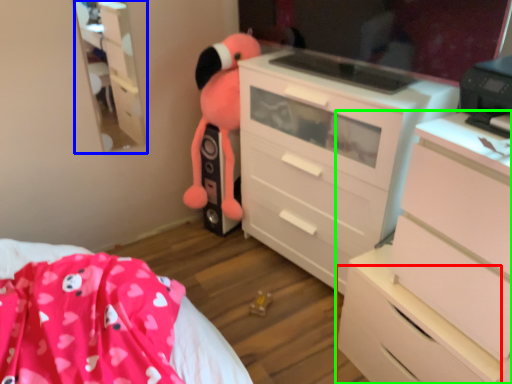
Question: Based on their relative distances, which object is farther from drawer (highlighted by a red box)? Choose from tv cabinet (highlighted by a blue box) and chest of drawers (highlighted by a green box).

Choices:
 (A) tv cabinet
 (B) chest of drawers

Answer: (A)